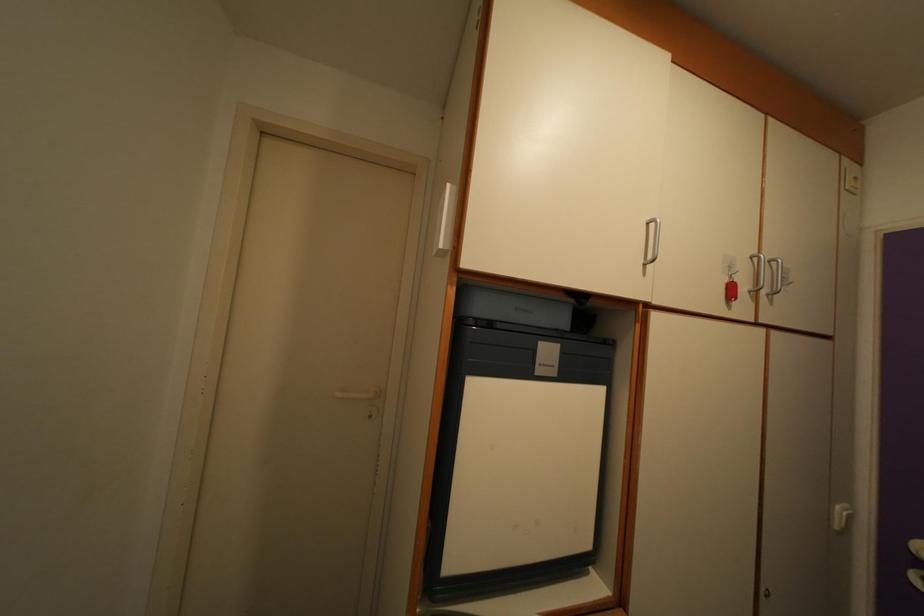
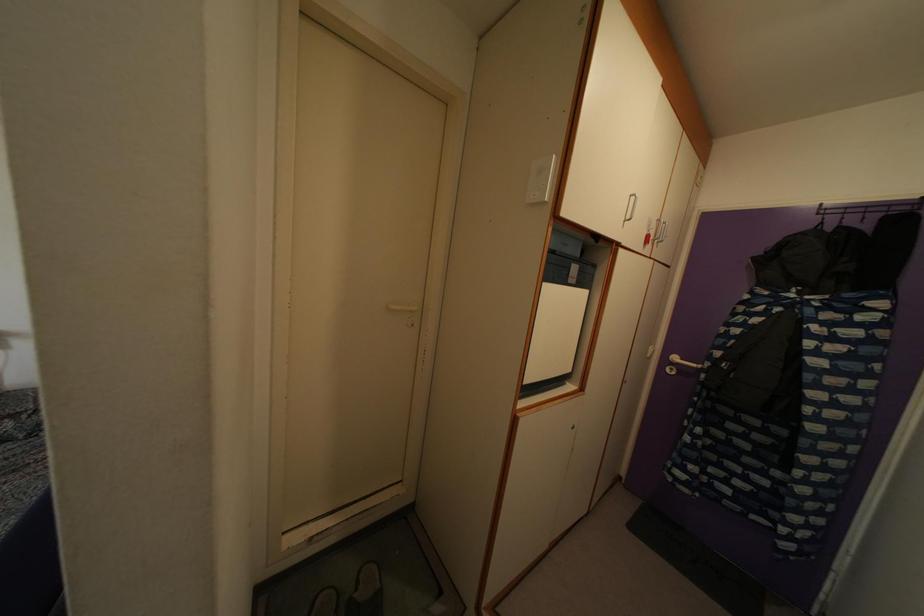
Question: What movement of the cameraman would produce the second image?

Choices:
 (A) Left
 (B) Right
 (C) Forward
 (D) Backward

Answer: (A)